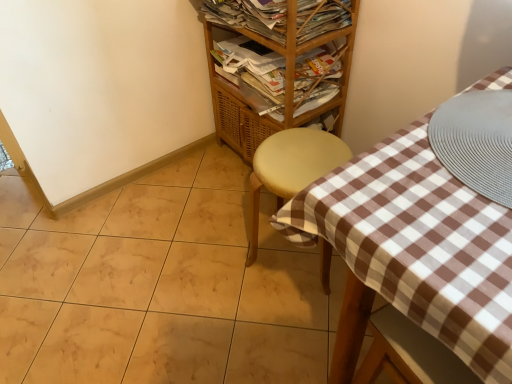
Question: Does wooden/matte shelf at upper center appear on the left side of matte yellow stool at center?

Choices:
 (A) yes
 (B) no

Answer: (A)

Question: Does wooden/matte shelf at upper center contain matte yellow stool at center?

Choices:
 (A) yes
 (B) no

Answer: (B)

Question: From the image's perspective, is wooden/matte shelf at upper center located above matte yellow stool at center?

Choices:
 (A) no
 (B) yes

Answer: (B)

Question: From a real-world perspective, does wooden/matte shelf at upper center stand above matte yellow stool at center?

Choices:
 (A) no
 (B) yes

Answer: (B)

Question: Is wooden/matte shelf at upper center located outside matte yellow stool at center?

Choices:
 (A) no
 (B) yes

Answer: (B)

Question: Is wooden/matte shelf at upper center aimed at matte yellow stool at center?

Choices:
 (A) no
 (B) yes

Answer: (A)

Question: Is wooden magazine at upper center, marked as the 1th magazine in a bottom-to-top arrangement, completely or partially outside of wooden magazine rack at upper center, which is the 1th magazine from top to bottom?

Choices:
 (A) yes
 (B) no

Answer: (A)

Question: From a real-world perspective, is wooden magazine at upper center, marked as the 2th magazine in a top-to-bottom arrangement, located beneath wooden magazine rack at upper center, which is the 1th magazine from top to bottom?

Choices:
 (A) yes
 (B) no

Answer: (A)

Question: Is wooden magazine at upper center, marked as the 2th magazine in a top-to-bottom arrangement, shorter than wooden magazine rack at upper center, which is the 1th magazine from top to bottom?

Choices:
 (A) no
 (B) yes

Answer: (B)

Question: Does wooden magazine at upper center, marked as the 1th magazine in a bottom-to-top arrangement, turn towards wooden magazine rack at upper center, which is the 2th magazine from bottom to top?

Choices:
 (A) no
 (B) yes

Answer: (A)

Question: From a real-world perspective, does wooden magazine at upper center, marked as the 1th magazine in a bottom-to-top arrangement, stand above wooden magazine rack at upper center, which is the 2th magazine from bottom to top?

Choices:
 (A) no
 (B) yes

Answer: (A)

Question: Can you confirm if wooden magazine at upper center, marked as the 1th magazine in a bottom-to-top arrangement, is positioned to the left of wooden magazine rack at upper center, which is the 2th magazine from bottom to top?

Choices:
 (A) yes
 (B) no

Answer: (B)

Question: Are wooden magazine rack at upper center, which is the 2th magazine from bottom to top, and matte yellow stool at center beside each other?

Choices:
 (A) no
 (B) yes

Answer: (A)